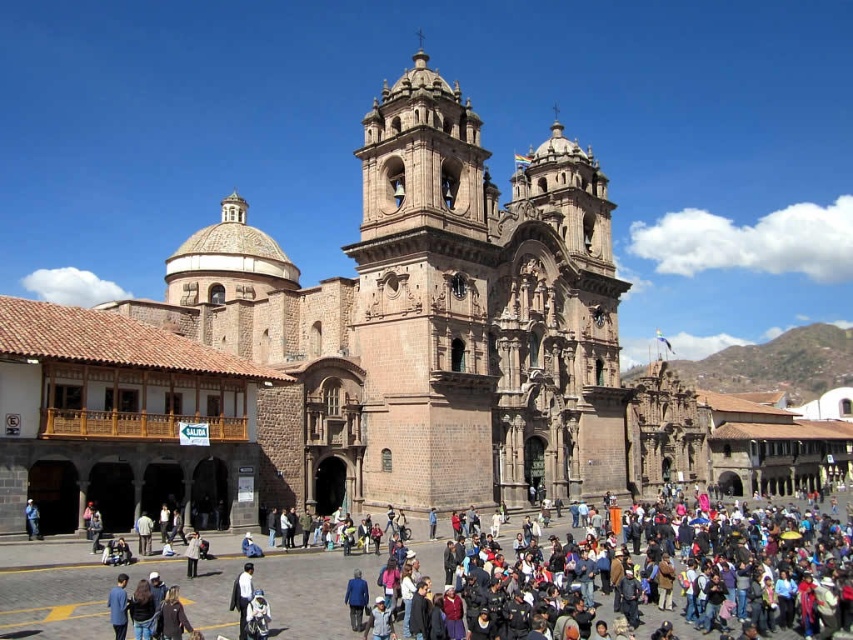
You are standing in the plaza and want to take a photo of the brown stone church at center. If your camera has a maximum focus range of 40 meters, will it be able to capture the church clearly?

The brown stone church at center is 44.18 meters away from the viewer. Since the camera can only focus up to 40 meters, it won cannot capture the church clearly within that range.

You are a photographer standing in the plaza and want to capture both the multicolored clothing at center and the dark blue suit at center in your photo. Which of the two will appear larger in the photo?

The multicolored clothing at center will appear larger in the photo because it is much taller than the dark blue suit at center.

You are standing in the plaza in front of the historic church. You notice two points marked on the ground. One is at coordinate point (311, 288) and the other at point (251, 564). If you are facing the church, which point is closer to the church?

Point (311, 288) is behind point (251, 564). Since you are facing the church, the point that is behind would be closer to the church. Therefore, point (311, 288) is closer to the church.